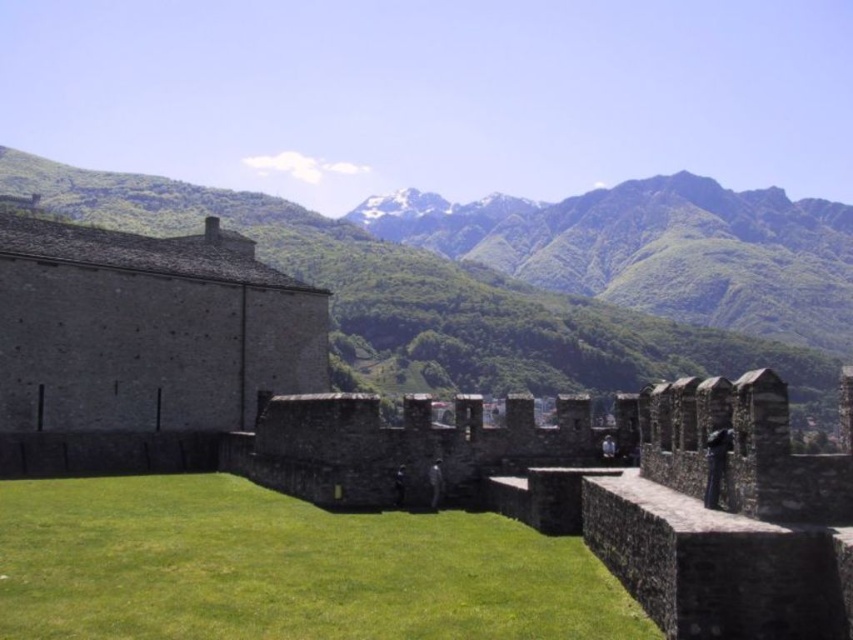
Question: Estimate the real-world distances between objects in this image. Which object is farther from the green grass at center?

Choices:
 (A) brown stone wall at center
 (B) green leafy mountain at upper center

Answer: (B)

Question: Which of the following is the farthest from the observer?

Choices:
 (A) green leafy mountain at upper center
 (B) brown stone wall at center
 (C) green grass at center

Answer: (A)

Question: Is green grass at center to the left of green leafy mountain at upper center from the viewer's perspective?

Choices:
 (A) yes
 (B) no

Answer: (B)

Question: Does green grass at center have a smaller size compared to green leafy mountain at upper center?

Choices:
 (A) no
 (B) yes

Answer: (B)

Question: Does green grass at center appear on the right side of green leafy mountain at upper center?

Choices:
 (A) no
 (B) yes

Answer: (B)

Question: Which of the following is the farthest from the observer?

Choices:
 (A) 148,534
 (B) 316,218
 (C) 746,396

Answer: (B)